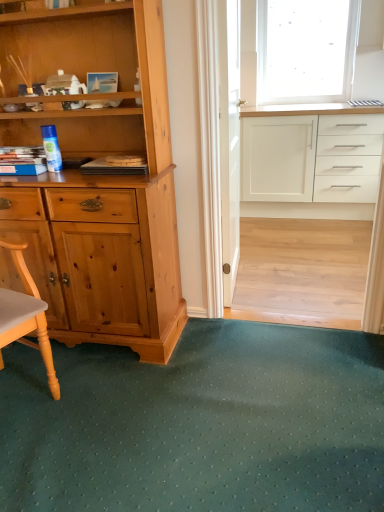
Question: Would you say white glossy cabinet at upper right contains transparent frosted glass at upper right?

Choices:
 (A) no
 (B) yes

Answer: (A)

Question: Is there a large distance between white glossy cabinet at upper right and transparent frosted glass at upper right?

Choices:
 (A) yes
 (B) no

Answer: (B)

Question: Does white glossy cabinet at upper right have a smaller size compared to transparent frosted glass at upper right?

Choices:
 (A) no
 (B) yes

Answer: (A)

Question: Does white glossy cabinet at upper right have a lesser width compared to transparent frosted glass at upper right?

Choices:
 (A) no
 (B) yes

Answer: (A)

Question: Is white glossy cabinet at upper right positioned beyond the bounds of transparent frosted glass at upper right?

Choices:
 (A) no
 (B) yes

Answer: (B)

Question: Is white glossy cabinet at upper right taller than transparent frosted glass at upper right?

Choices:
 (A) yes
 (B) no

Answer: (B)

Question: Is transparent frosted glass at upper right to the right of clear glass screen door at center from the viewer's perspective?

Choices:
 (A) no
 (B) yes

Answer: (B)

Question: Is transparent frosted glass at upper right further to the viewer compared to clear glass screen door at center?

Choices:
 (A) yes
 (B) no

Answer: (A)

Question: From a real-world perspective, does transparent frosted glass at upper right stand above clear glass screen door at center?

Choices:
 (A) yes
 (B) no

Answer: (A)

Question: Could clear glass screen door at center be considered to be inside transparent frosted glass at upper right?

Choices:
 (A) yes
 (B) no

Answer: (B)

Question: Is transparent frosted glass at upper right outside clear glass screen door at center?

Choices:
 (A) yes
 (B) no

Answer: (A)

Question: Considering the relative positions of transparent frosted glass at upper right and clear glass screen door at center in the image provided, is transparent frosted glass at upper right in front of clear glass screen door at center?

Choices:
 (A) no
 (B) yes

Answer: (A)

Question: From a real-world perspective, is transparent frosted glass at upper right on top of white glossy cabinet at upper right?

Choices:
 (A) no
 (B) yes

Answer: (B)